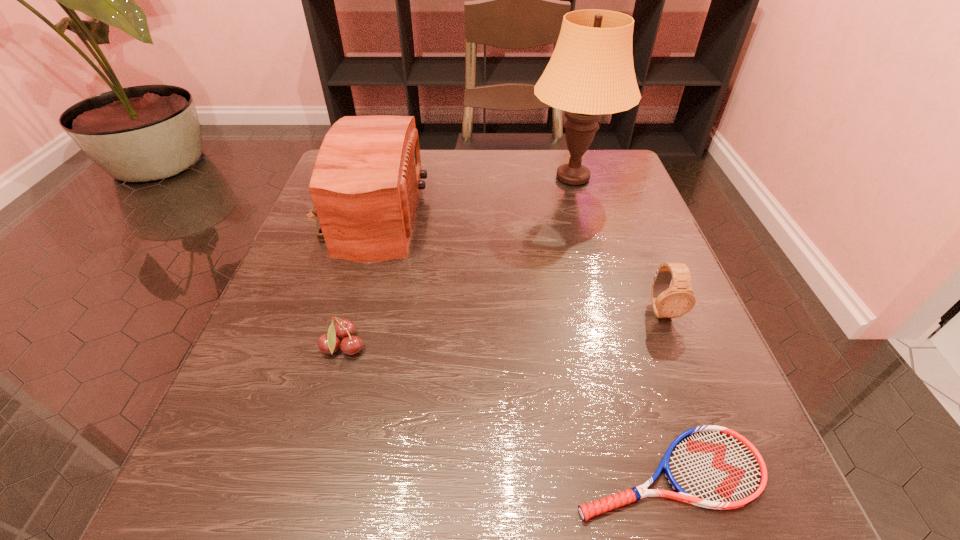
You are a GUI agent. You are given a task and a screenshot of the screen. Output one action in this format:
    pyautogui.click(x=<x>, y=<y>)
    Task: Click on the object that can be found as the fourth closest to the cherry
    The height and width of the screenshot is (540, 960).
    Given the screenshot: What is the action you would take?
    pyautogui.click(x=668, y=302)

Select which object appears as the second closest to the lampshade. Please provide its 2D coordinates. Your answer should be formatted as a tuple, i.e. [(x, y)], where the tuple contains the x and y coordinates of a point satisfying the conditions above.

[(668, 302)]

The image size is (960, 540). I want to click on free space that satisfies the following two spatial constraints: 1. on the front side of the lampshade; 2. on the right side of the shortest object, so click(657, 473).

Where is `vacant area in the image that satisfies the following two spatial constraints: 1. on the face of the watch; 2. on the leaves of the second nearest object`? This screenshot has width=960, height=540. vacant area in the image that satisfies the following two spatial constraints: 1. on the face of the watch; 2. on the leaves of the second nearest object is located at coordinates (676, 348).

The image size is (960, 540). What are the coordinates of `vacant space that satisfies the following two spatial constraints: 1. on the leaves of the fourth farthest object; 2. on the back side of the nearest object` in the screenshot? It's located at (309, 473).

Locate an element on the screen. vacant space that satisfies the following two spatial constraints: 1. on the leaves of the nearest object; 2. on the right side of the fourth tallest object is located at coordinates (309, 473).